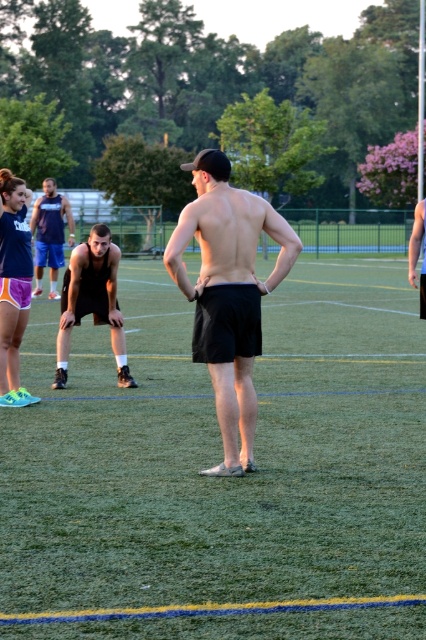
The width and height of the screenshot is (426, 640). What do you see at coordinates (227, 294) in the screenshot? I see `black matte shorts at center` at bounding box center [227, 294].

Is point (224, 385) positioned in front of point (36, 211)?

Yes, point (224, 385) is in front of point (36, 211).

The height and width of the screenshot is (640, 426). Find the location of `black matte shorts at center`. black matte shorts at center is located at coordinates (227, 294).

Which of these two, green artificial turf at center or black athletic shorts at center, stands taller?

With more height is black athletic shorts at center.

Does green artificial turf at center appear over black athletic shorts at center?

Actually, green artificial turf at center is below black athletic shorts at center.

Between point (262, 481) and point (45, 192), which one is positioned behind?

The point (45, 192) is behind.

Find the location of `green artificial turf at center`. green artificial turf at center is located at coordinates (221, 452).

Is black matte shorts at lower left bigger than black athletic shorts at center?

Incorrect, black matte shorts at lower left is not larger than black athletic shorts at center.

Is point (62, 380) farther from viewer compared to point (43, 224)?

That is False.

Where is `black matte shorts at lower left`? This screenshot has width=426, height=640. black matte shorts at lower left is located at coordinates coord(92,300).